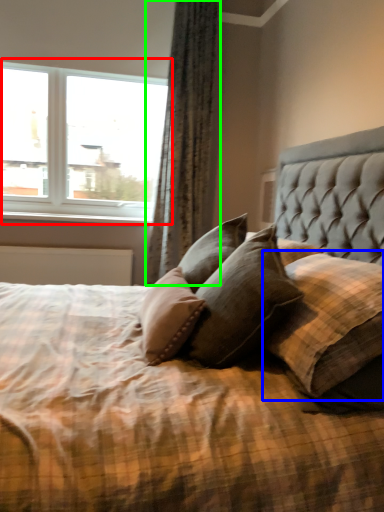
Question: Considering the real-world distances, which object is closest to window (highlighted by a red box)? pillow (highlighted by a blue box) or curtain (highlighted by a green box).

Choices:
 (A) pillow
 (B) curtain

Answer: (B)